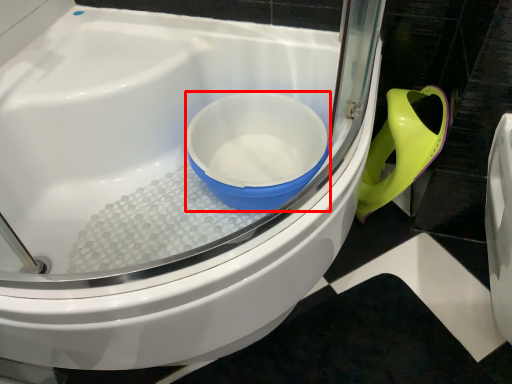
Question: Where is mixing bowl (annotated by the red box) located in relation to toilet in the image?

Choices:
 (A) left
 (B) right

Answer: (B)